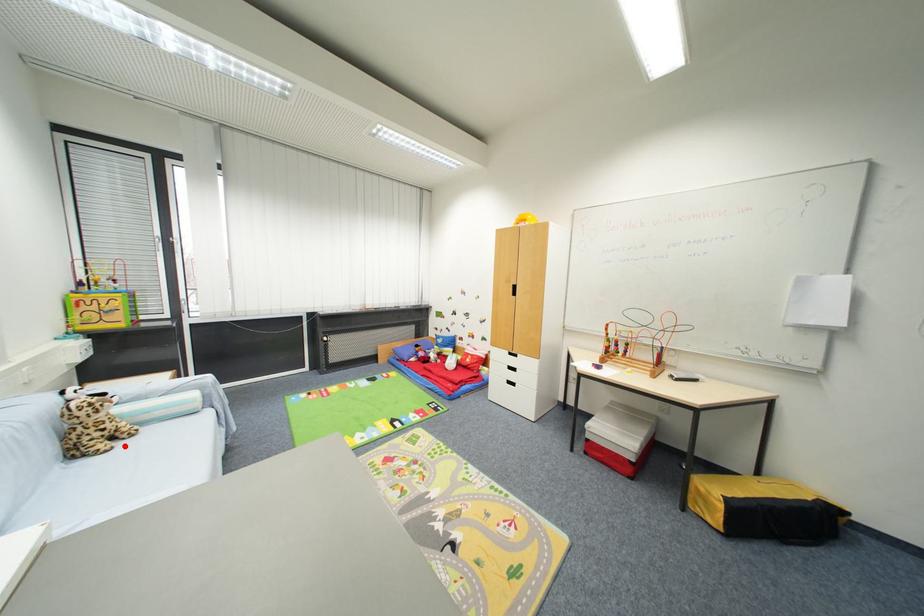
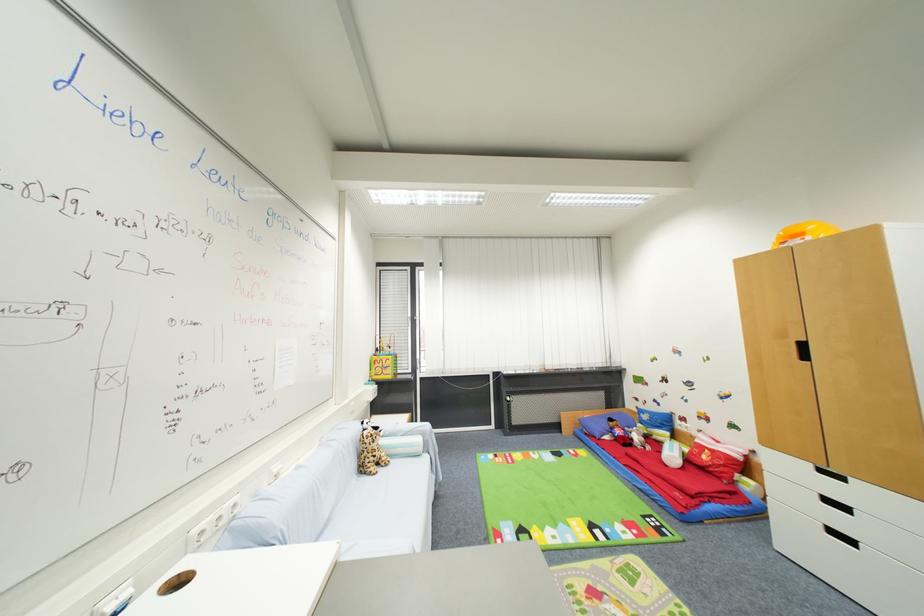
In the second image, find the point that corresponds to the highlighted location in the first image.

(385, 472)